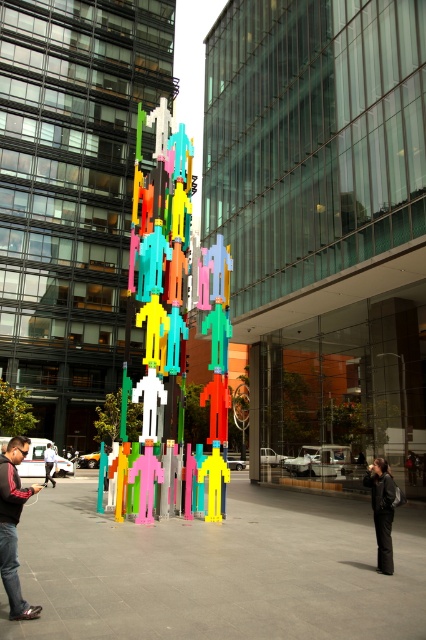
Does black leather jacket at lower left have a smaller size compared to white plastic figure at center?

No.

Locate an element on the screen. The height and width of the screenshot is (640, 426). black leather jacket at lower left is located at coordinates (14, 525).

Between point (5, 566) and point (46, 452), which one is positioned behind?

Point (46, 452)

Find the location of a particular element. The height and width of the screenshot is (640, 426). black leather jacket at lower left is located at coordinates (14, 525).

Does point (160, 358) come behind point (11, 499)?

Yes.

Describe the element at coordinates (158, 284) in the screenshot. The image size is (426, 640). I see `multicolored plastic figures at center` at that location.

Is point (155, 109) closer to camera compared to point (9, 508)?

That is False.

The width and height of the screenshot is (426, 640). In order to click on multicolored plastic figures at center in this screenshot , I will do `click(158, 284)`.

Between multicolored plastic figures at center and white plastic figure at center, which one is positioned higher?

multicolored plastic figures at center

Between multicolored plastic figures at center and white plastic figure at center, which one appears on the right side from the viewer's perspective?

From the viewer's perspective, multicolored plastic figures at center appears more on the right side.

You are a GUI agent. You are given a task and a screenshot of the screen. Output one action in this format:
    pyautogui.click(x=<x>, y=<y>)
    Task: Click on the multicolored plastic figures at center
    This screenshot has width=426, height=640.
    Given the screenshot: What is the action you would take?
    pyautogui.click(x=158, y=284)

I want to click on multicolored plastic figures at center, so pos(158,284).